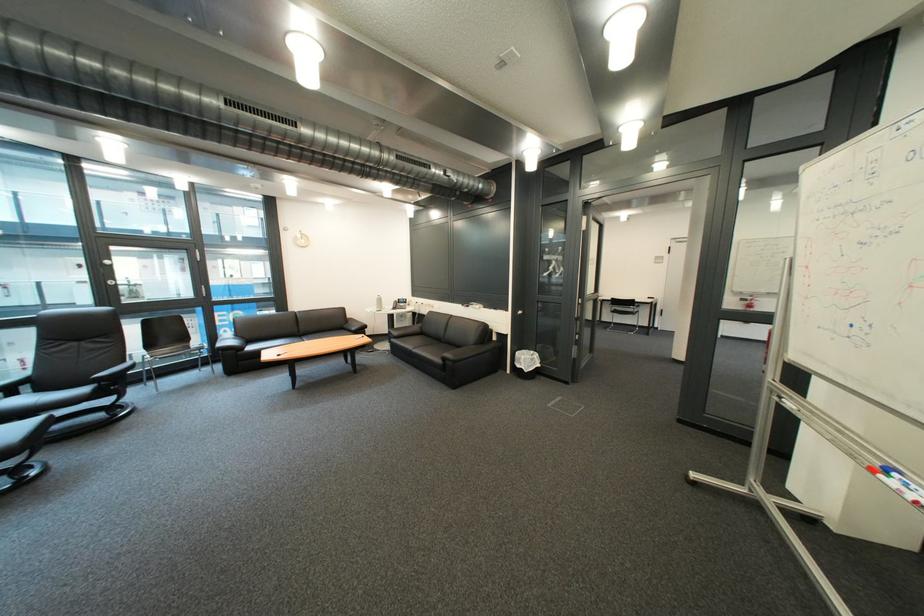
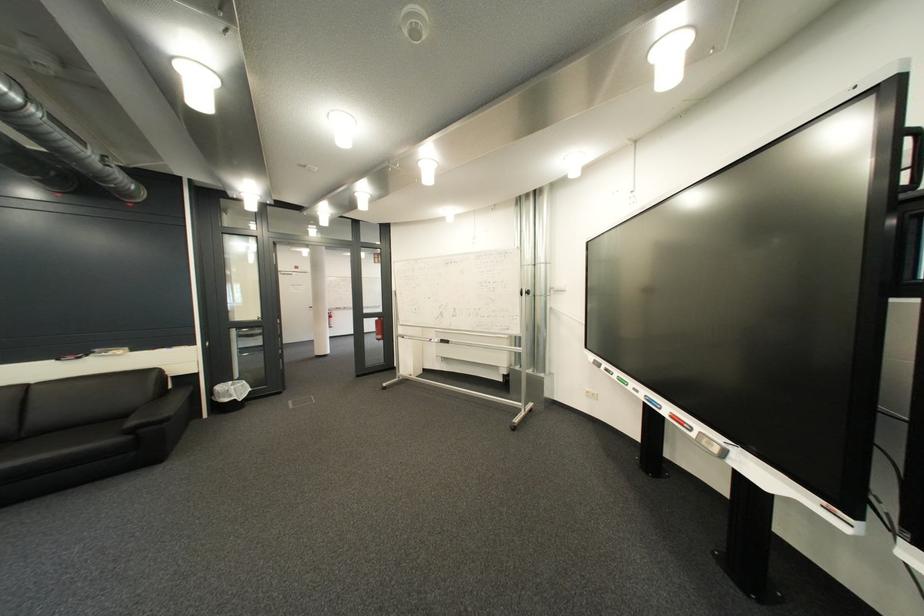
Where in the second image is the point corresponding to (545,354) from the first image?

(245, 384)